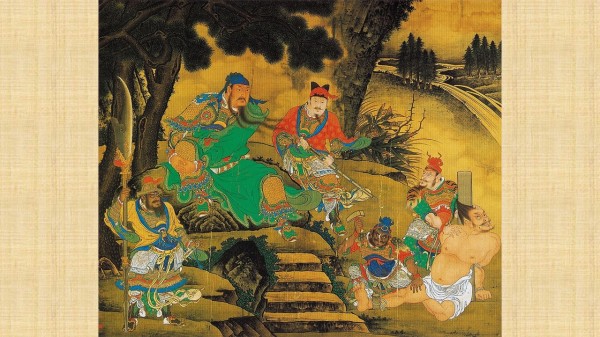
The height and width of the screenshot is (337, 600). I want to click on painting, so click(369, 179).